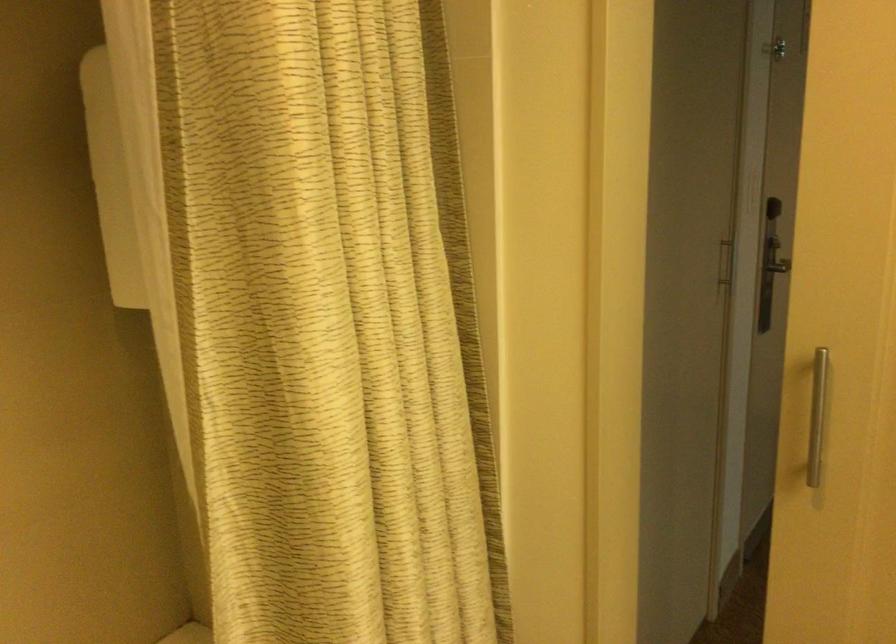
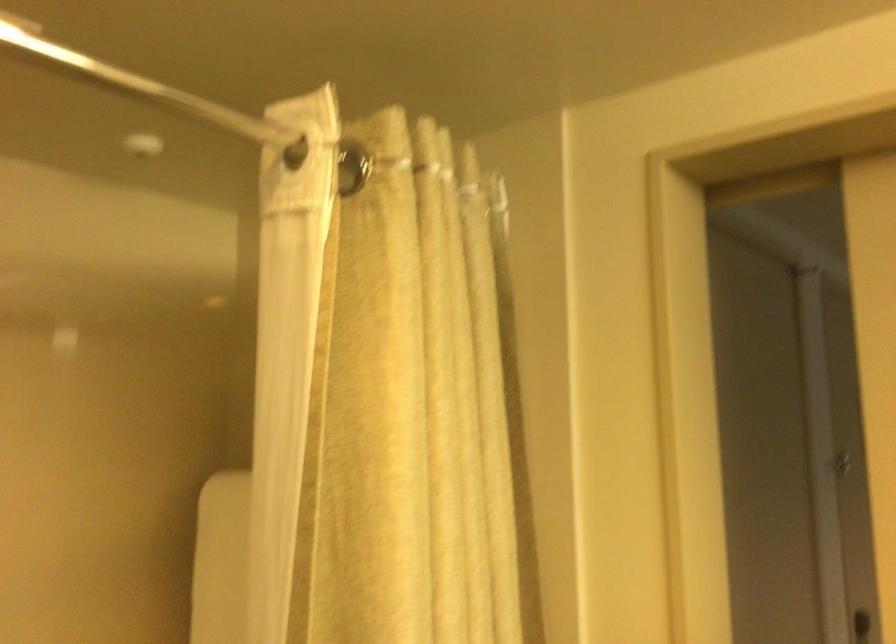
Question: Based on the continuous images, in which direction is the camera rotating? Reply with the corresponding letter.

Choices:
 (A) Left
 (B) Right
 (C) Up
 (D) Down

Answer: (C)